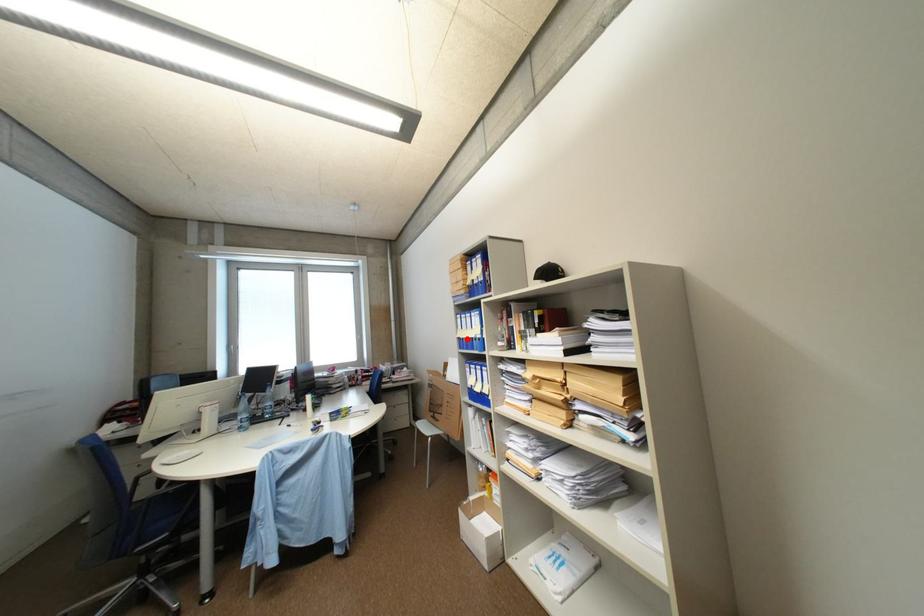
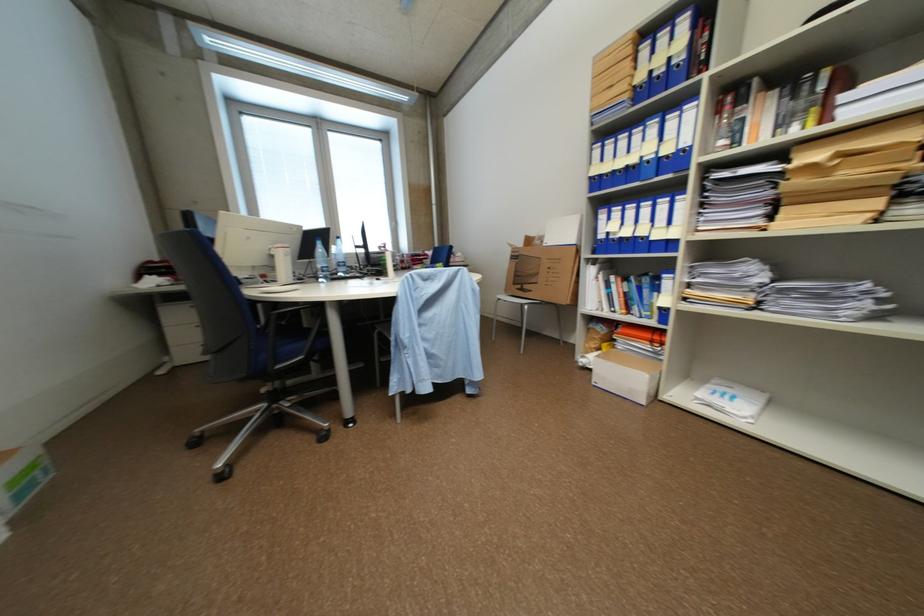
Find the pixel in the second image that matches the highlighted location in the first image.

(600, 180)